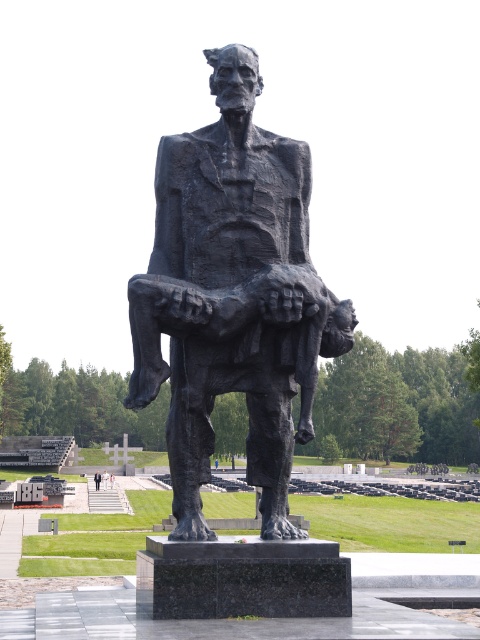
Question: Does bronze statue at center appear on the right side of white glossy person at center?

Choices:
 (A) yes
 (B) no

Answer: (A)

Question: Which of the following is the farthest from the observer?

Choices:
 (A) white glossy person at center
 (B) bronze statue at center

Answer: (A)

Question: In this image, where is light brown wooden person at center located relative to white glossy person at center?

Choices:
 (A) left
 (B) right

Answer: (A)

Question: Is light brown wooden person at center to the left of light gray concrete statue at center from the viewer's perspective?

Choices:
 (A) no
 (B) yes

Answer: (B)

Question: Based on their relative distances, which object is nearer to the white glossy person at center?

Choices:
 (A) light gray concrete statue at center
 (B) bronze statue at center
 (C) light brown wooden person at center

Answer: (C)

Question: Based on their relative distances, which object is nearer to the white glossy person at center?

Choices:
 (A) bronze statue at center
 (B) light gray concrete statue at center
 (C) light brown wooden person at center

Answer: (C)